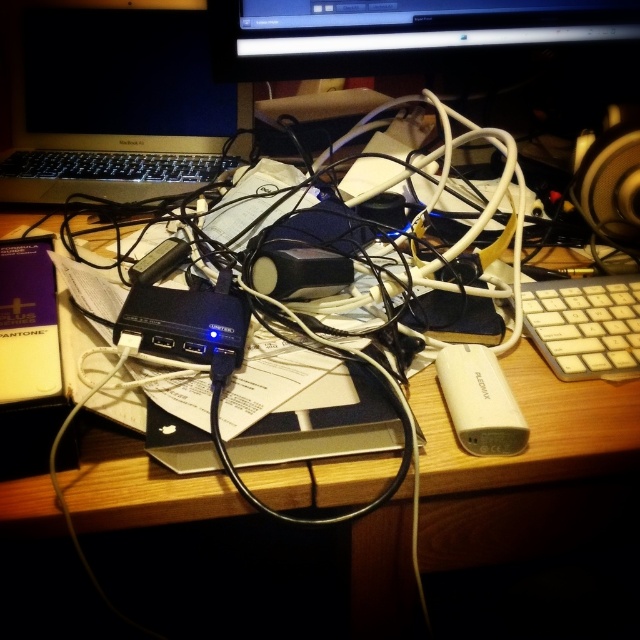
Does silver metallic laptop at upper left appear on the right side of black glossy monitor at upper center?

Incorrect, silver metallic laptop at upper left is not on the right side of black glossy monitor at upper center.

From the picture: Is silver metallic laptop at upper left smaller than black glossy monitor at upper center?

Incorrect, silver metallic laptop at upper left is not smaller in size than black glossy monitor at upper center.

Between point (118, 200) and point (259, 77), which one is positioned behind?

The point (118, 200) is behind.

Find the location of a particular element. Image resolution: width=640 pixels, height=640 pixels. silver metallic laptop at upper left is located at coordinates (116, 106).

Is white plastic ipod at lower right smaller than black fabric speaker at upper right?

Yes.

Is white plastic ipod at lower right to the left of black fabric speaker at upper right from the viewer's perspective?

Correct, you'll find white plastic ipod at lower right to the left of black fabric speaker at upper right.

The height and width of the screenshot is (640, 640). What do you see at coordinates (480, 401) in the screenshot?
I see `white plastic ipod at lower right` at bounding box center [480, 401].

The image size is (640, 640). Find the location of `white plastic ipod at lower right`. white plastic ipod at lower right is located at coordinates (480, 401).

Which is above, silver metallic laptop at upper left or white plastic keyboard at right?

silver metallic laptop at upper left

How distant is silver metallic laptop at upper left from white plastic keyboard at right?

silver metallic laptop at upper left and white plastic keyboard at right are 23.43 inches apart from each other.

What do you see at coordinates (116, 106) in the screenshot?
I see `silver metallic laptop at upper left` at bounding box center [116, 106].

Where is `silver metallic laptop at upper left`? silver metallic laptop at upper left is located at coordinates (116, 106).